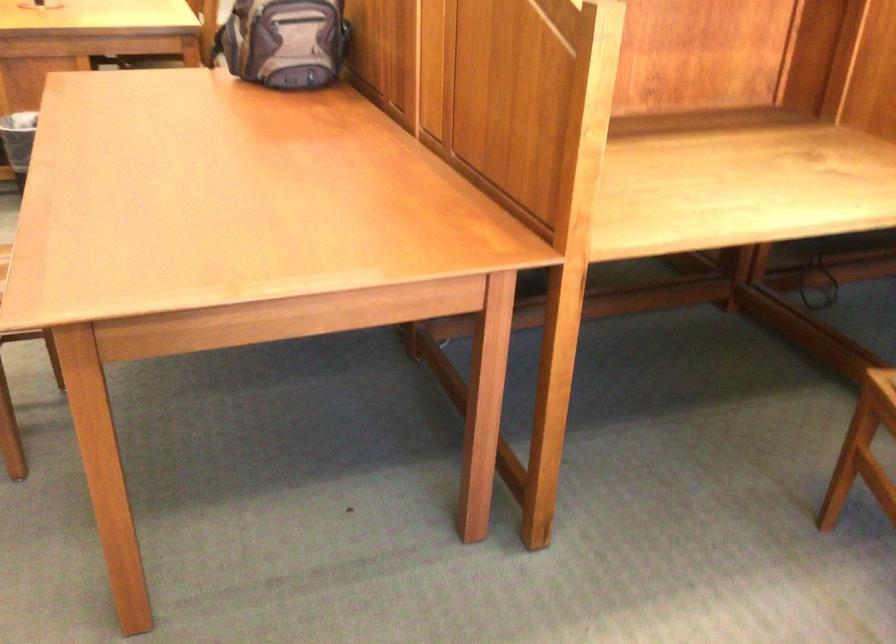
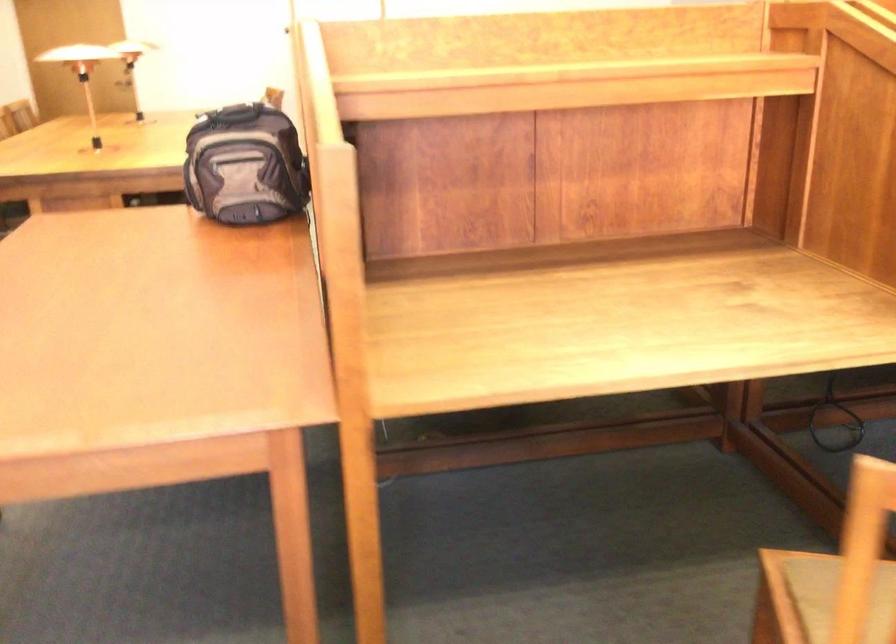
Question: Based on the continuous images, in which direction is the camera rotating? Reply with the corresponding letter.

Choices:
 (A) Left
 (B) Right
 (C) Up
 (D) Down

Answer: (A)